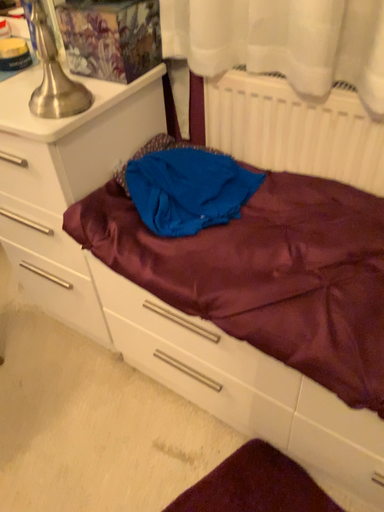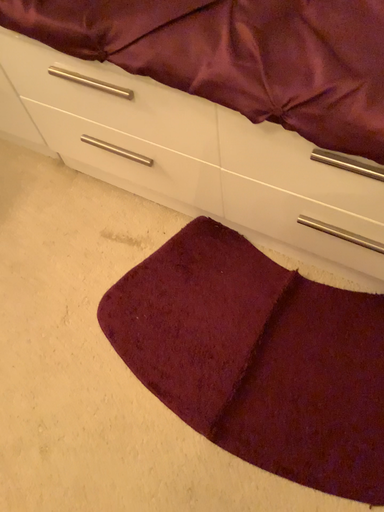
Question: How did the camera likely rotate when shooting the video?

Choices:
 (A) rotated downward
 (B) rotated upward

Answer: (A)